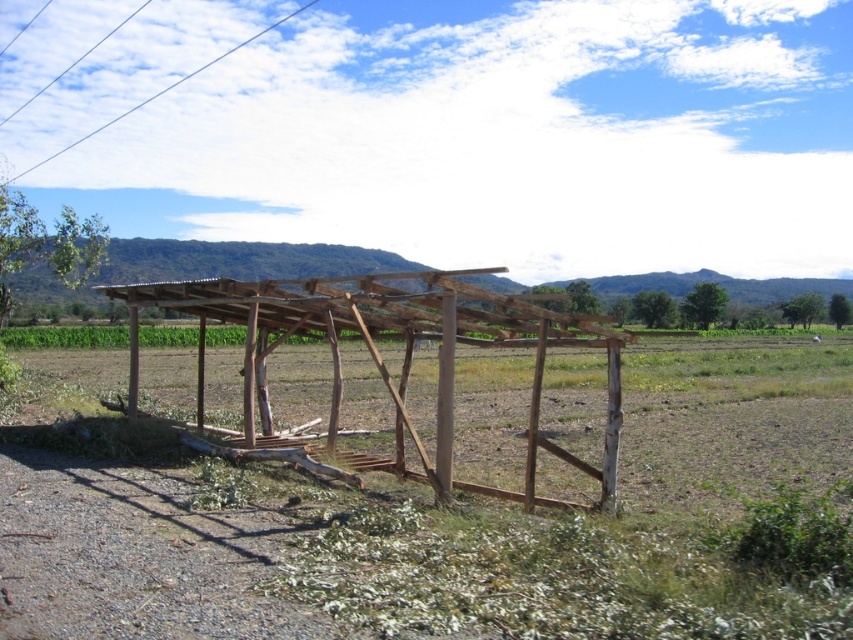
Between brown wooden structure at center and white wire at upper left, which one appears on the right side from the viewer's perspective?

brown wooden structure at center

In order to click on brown wooden structure at center in this screenshot , I will do `click(403, 355)`.